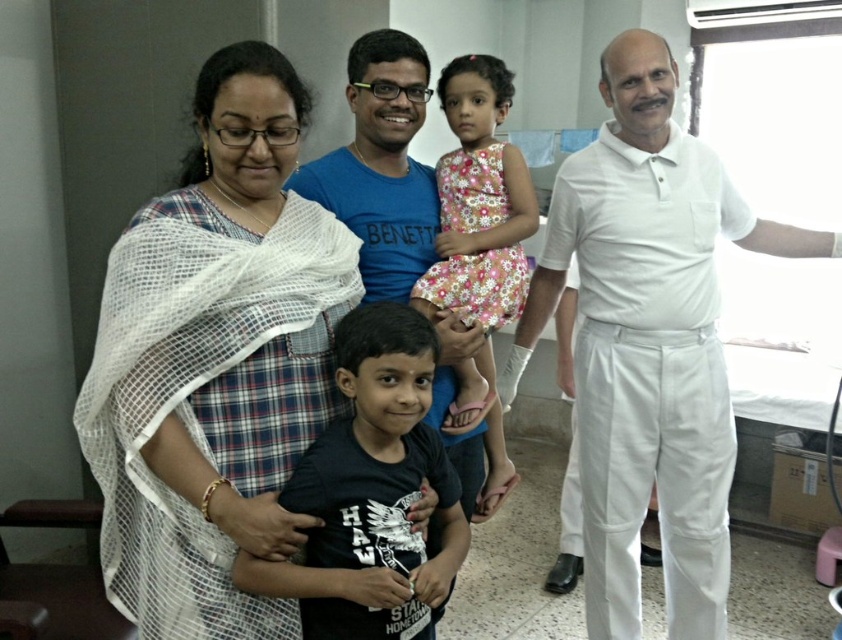
Question: Which of these objects is positioned closest to the white cotton shirt at right?

Choices:
 (A) black matte shirt at center
 (B) floral dress at center
 (C) white plaid saree at left
 (D) blue cotton t-shirt at center

Answer: (B)

Question: Which of the following is the closest to the observer?

Choices:
 (A) white plaid saree at left
 (B) black matte shirt at center

Answer: (A)

Question: Does white plaid saree at left have a lesser width compared to black matte shirt at center?

Choices:
 (A) yes
 (B) no

Answer: (B)

Question: Does white plaid saree at left appear on the left side of black matte shirt at center?

Choices:
 (A) no
 (B) yes

Answer: (B)

Question: Can you confirm if white cotton shirt at right is smaller than floral dress at center?

Choices:
 (A) no
 (B) yes

Answer: (A)

Question: Among these points, which one is nearest to the camera?

Choices:
 (A) (421, 202)
 (B) (685, 484)

Answer: (A)